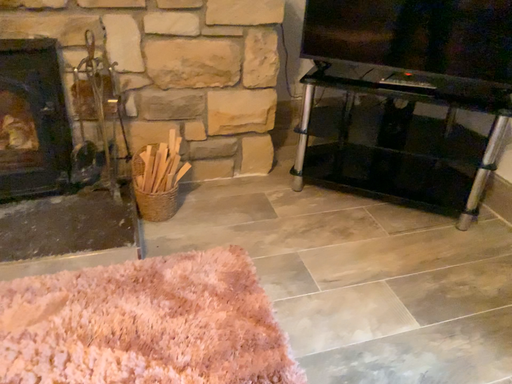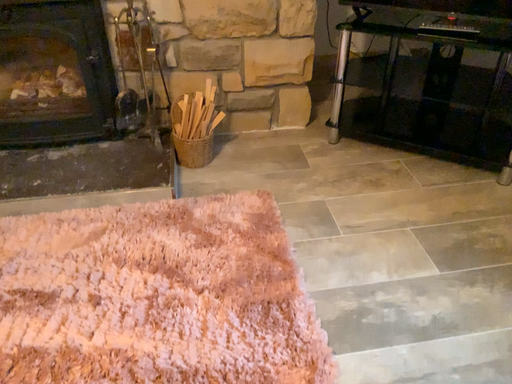
Question: How did the camera likely rotate when shooting the video?

Choices:
 (A) rotated left
 (B) rotated right

Answer: (A)